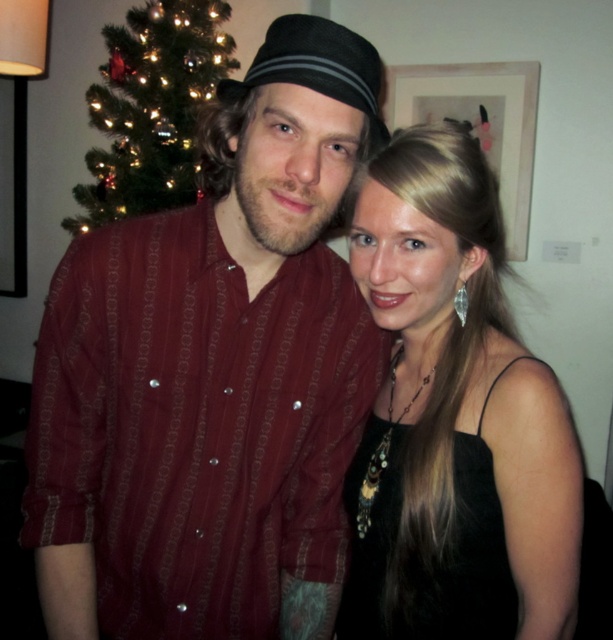
In order to click on black satin dress at right in this screenshot , I will do `click(454, 419)`.

Is black satin dress at right shorter than black satin dress at center?

No, black satin dress at right is not shorter than black satin dress at center.

Who is more forward, (421, 545) or (489, 520)?

Positioned in front is point (421, 545).

The image size is (613, 640). In order to click on black satin dress at right in this screenshot , I will do `click(454, 419)`.

Who is shorter, matte red shirt at center or black satin dress at center?

Standing shorter between the two is black satin dress at center.

How distant is matte red shirt at center from black satin dress at center?

→ matte red shirt at center is 7.57 inches from black satin dress at center.

Between point (292, 168) and point (473, 620), which one is positioned in front?

Positioned in front is point (292, 168).

The height and width of the screenshot is (640, 613). In order to click on matte red shirt at center in this screenshot , I will do `click(213, 374)`.

The height and width of the screenshot is (640, 613). Identify the location of matte red shirt at center. (213, 374).

Between matte red shirt at center and black satin dress at right, which one appears on the right side from the viewer's perspective?

black satin dress at right is more to the right.

Does point (109, 440) lie in front of point (543, 547)?

No, it is behind (543, 547).

Where is `matte red shirt at center`? The width and height of the screenshot is (613, 640). matte red shirt at center is located at coordinates (213, 374).